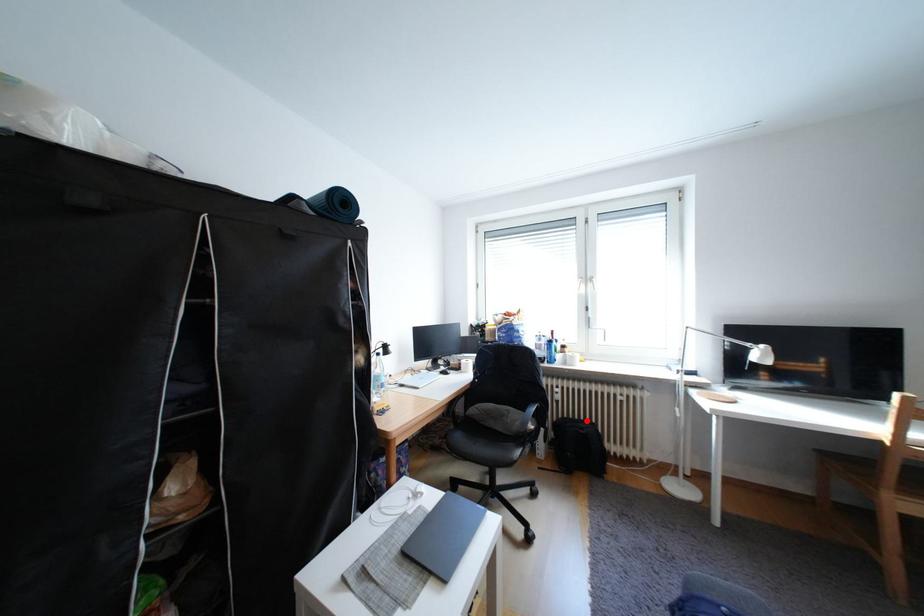
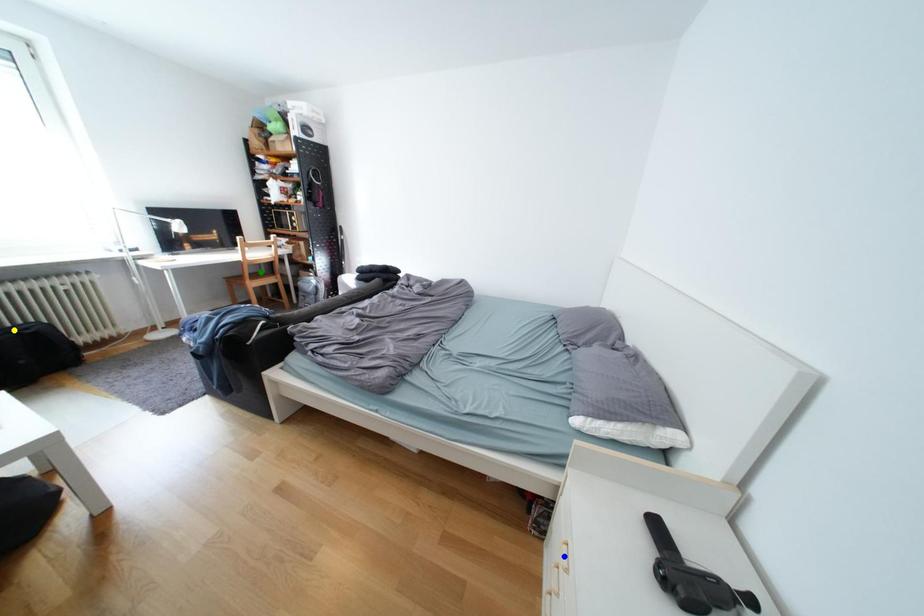
Question: I am providing you with two images of the same scene from different viewpoints. A red point is marked on the first image. You are given multiple points on the second image. In image 2, which mark is for the same physical point as the one in image 1?

Choices:
 (A) green point
 (B) blue point
 (C) yellow point

Answer: (C)